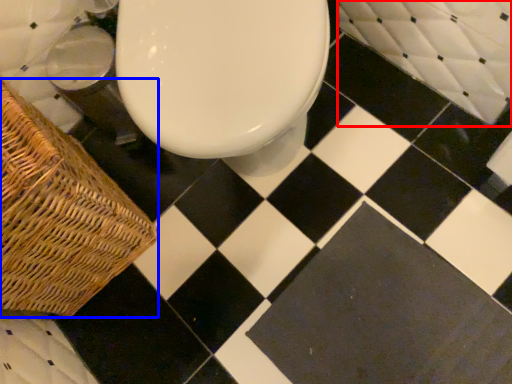
Question: Which object appears closest to the camera in this image, bath (highlighted by a red box) or picnic basket (highlighted by a blue box)?

Choices:
 (A) bath
 (B) picnic basket

Answer: (B)